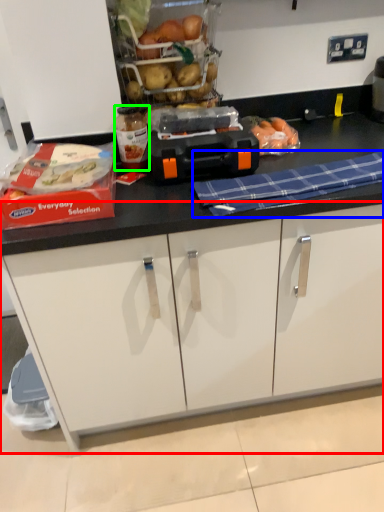
Question: Estimate the real-world distances between objects in this image. Which object is farther from cabinetry (highlighted by a red box), blanket (highlighted by a blue box) or bottle (highlighted by a green box)?

Choices:
 (A) blanket
 (B) bottle

Answer: (B)